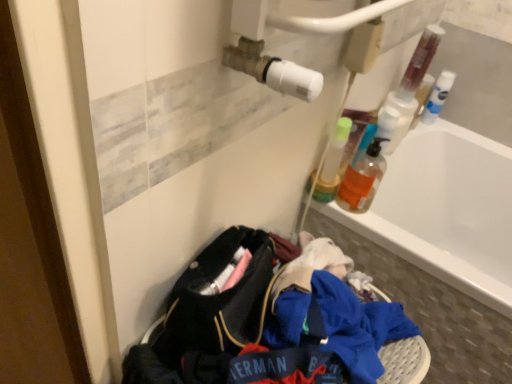
Question: Based on their sizes in the image, would you say white glossy bathtub at upper right is bigger or smaller than white plastic bottle at upper right, which is the first bottle in right-to-left order?

Choices:
 (A) big
 (B) small

Answer: (A)

Question: In the image, is white glossy bathtub at upper right on the left side or the right side of white plastic bottle at upper right, which is the third bottle from left to right?

Choices:
 (A) right
 (B) left

Answer: (B)

Question: Considering the real-world distances, which object is closest to the white glossy bathtub at upper right?

Choices:
 (A) translucent orange liquid at upper right, acting as the 1th bottle starting from the front
 (B) translucent plastic bottle at upper right, the second bottle from the back
 (C) white plastic bottle at upper right, which is counted as the first bottle, starting from the back
 (D) translucent plastic bottle at upper right

Answer: (C)

Question: Based on their relative distances, which object is nearer to the translucent plastic bottle at upper right?

Choices:
 (A) translucent orange liquid at upper right, the second bottle when ordered from left to right
 (B) translucent plastic bottle at upper right, the second bottle from the back
 (C) white plastic bottle at upper right, which is the third bottle from left to right
 (D) white glossy bathtub at upper right

Answer: (B)